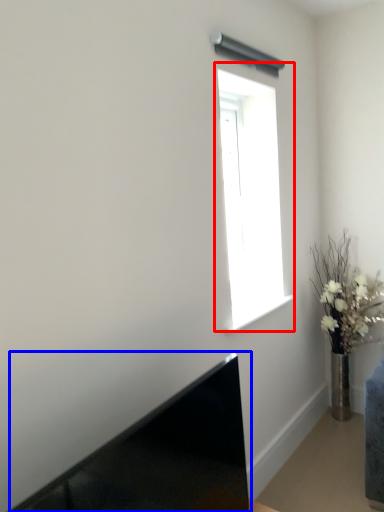
Question: Among these objects, which one is farthest to the camera, window (highlighted by a red box) or laptop (highlighted by a blue box)?

Choices:
 (A) window
 (B) laptop

Answer: (A)